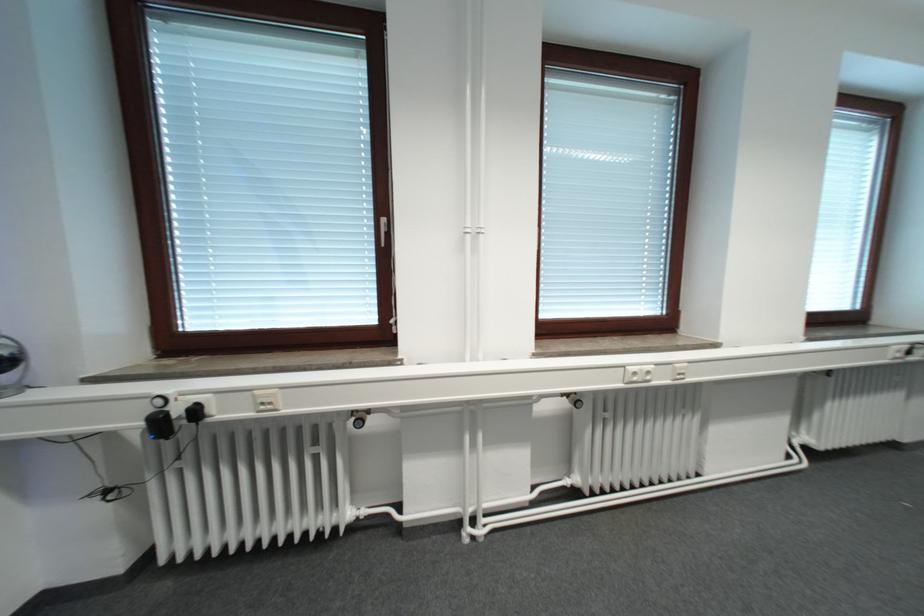
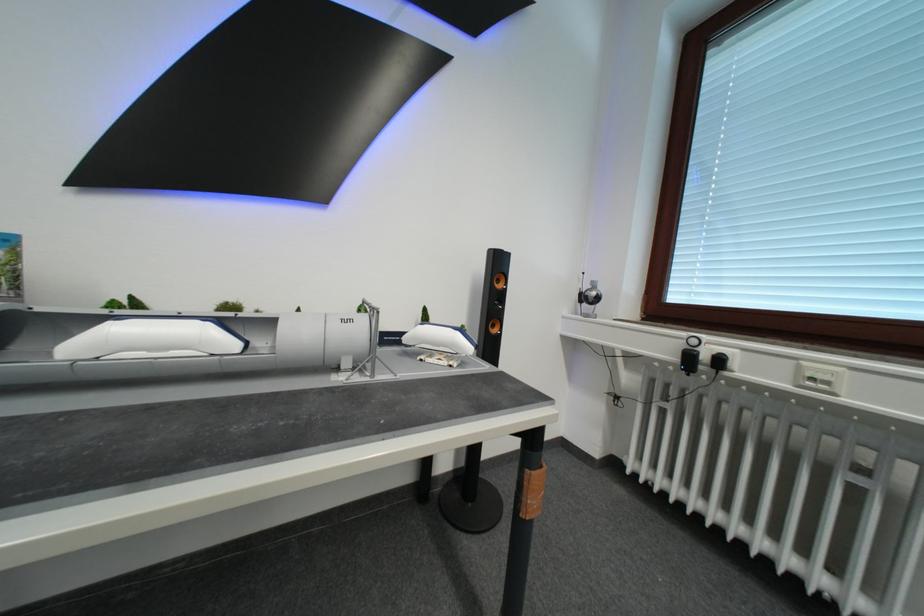
The point at (263,399) is marked in the first image. Where is the corresponding point in the second image?

(809, 369)